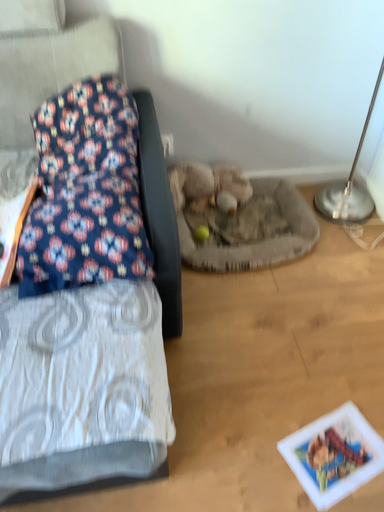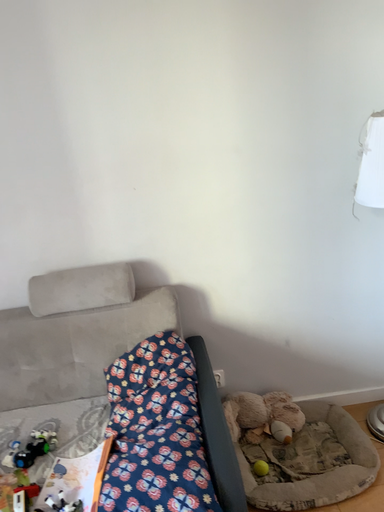
Question: How did the camera likely rotate when shooting the video?

Choices:
 (A) rotated right
 (B) rotated left

Answer: (B)